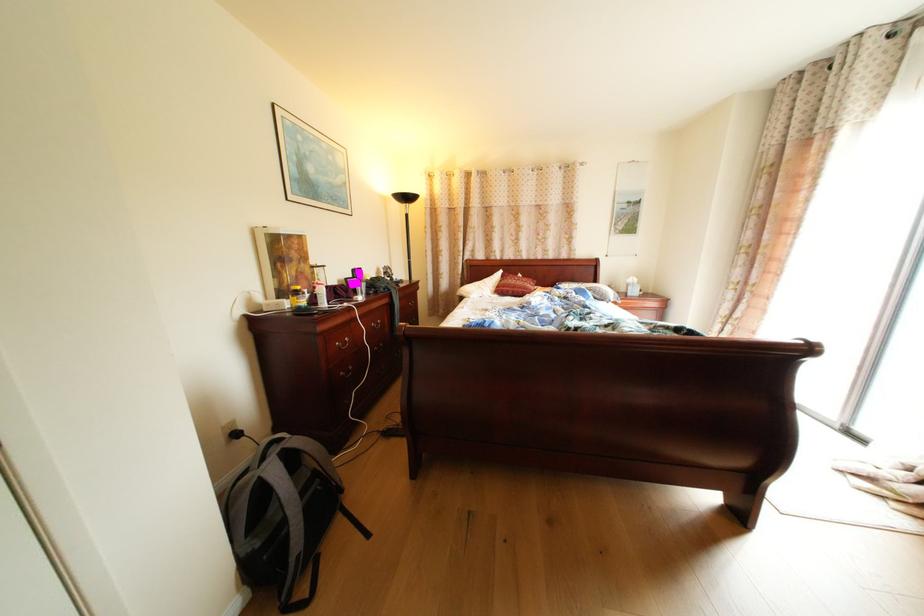
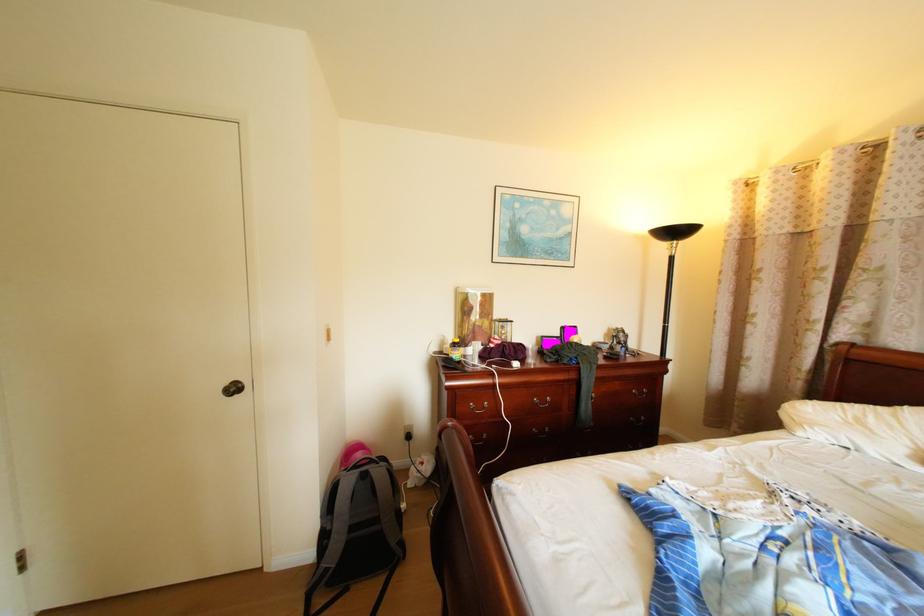
Locate, in the second image, the point that corresponds to point (263, 304) in the first image.

(456, 345)